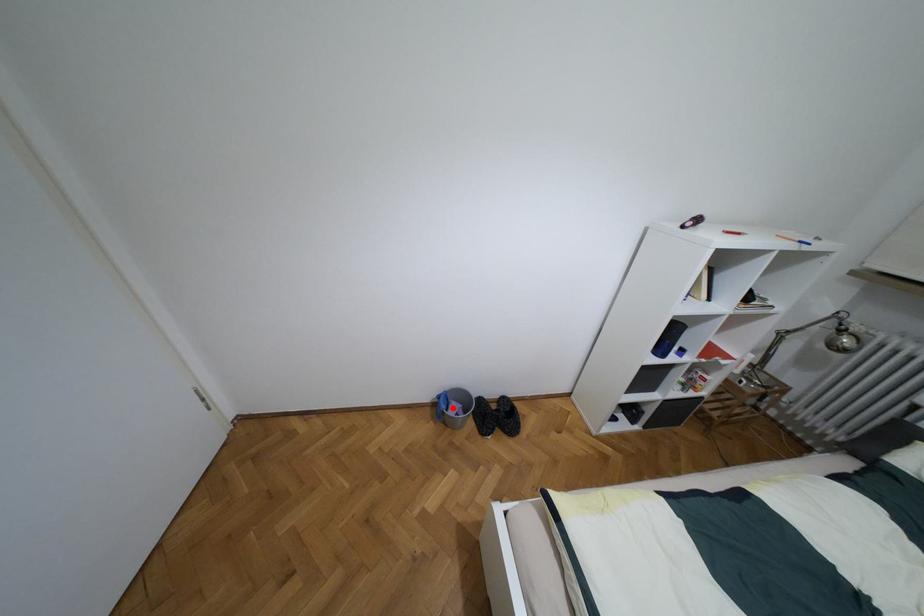
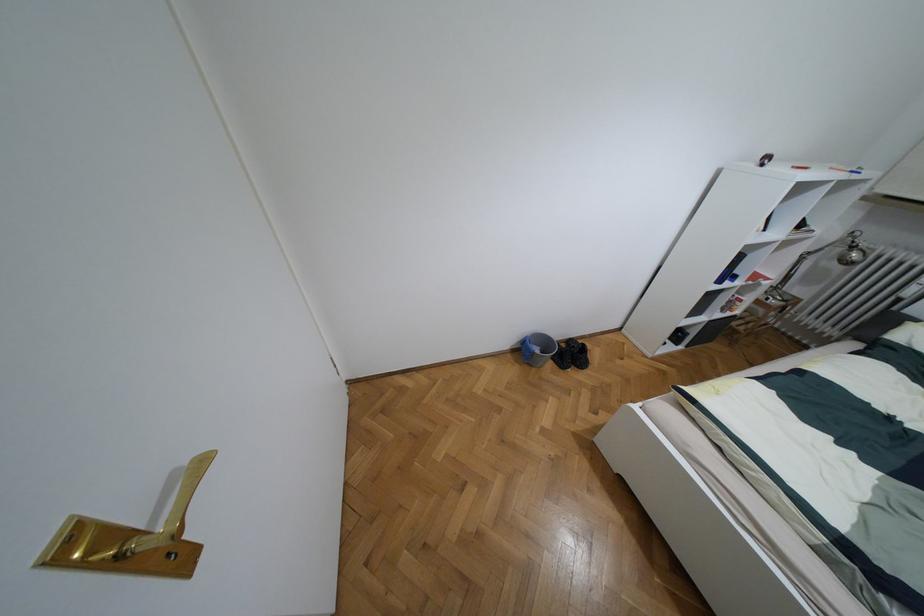
Locate, in the second image, the point that corresponds to the highlighted location in the first image.

(536, 350)